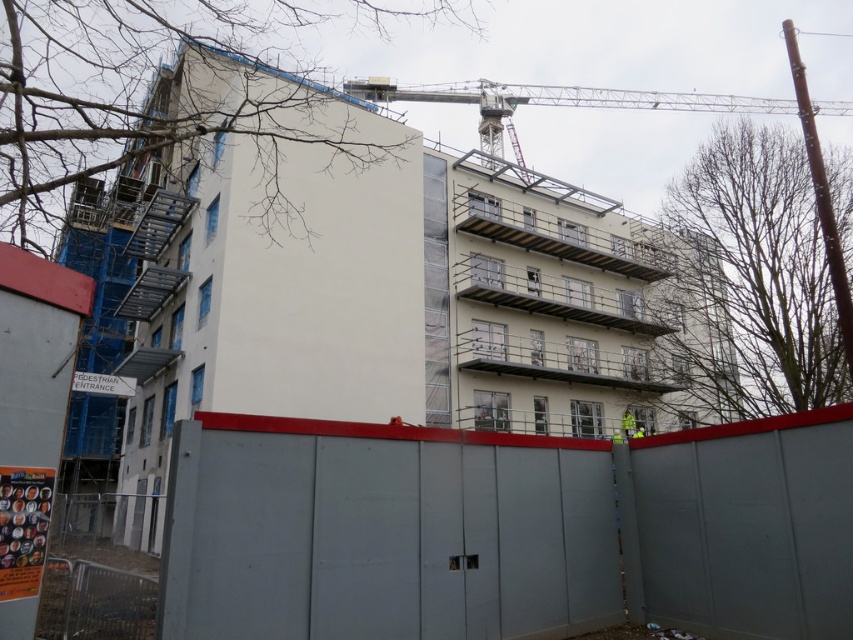
Which is in front, point (370, 579) or point (792, 106)?

Positioned in front is point (370, 579).

The image size is (853, 640). I want to click on gray metal fence at lower center, so click(x=505, y=531).

Who is more distant from viewer, (289, 449) or (811, 104)?

Positioned behind is point (811, 104).

Where is `gray metal fence at lower center`? The height and width of the screenshot is (640, 853). gray metal fence at lower center is located at coordinates (505, 531).

Consider the image. Does metallic silver crane at upper center appear on the left side of metallic silver fence at lower left?

Incorrect, metallic silver crane at upper center is not on the left side of metallic silver fence at lower left.

Measure the distance from metallic silver crane at upper center to metallic silver fence at lower left.

metallic silver crane at upper center and metallic silver fence at lower left are 75.85 feet apart.

Locate an element on the screen. The image size is (853, 640). metallic silver crane at upper center is located at coordinates (554, 100).

Where is `metallic silver crane at upper center`? This screenshot has height=640, width=853. metallic silver crane at upper center is located at coordinates (554, 100).

Measure the distance between point [604,611] and camera.

A distance of 24.05 feet exists between point [604,611] and camera.

Who is higher up, gray metal fence at lower center or reflective yellow safety vest at center?

gray metal fence at lower center

Which is in front, point (384, 440) or point (634, 422)?

Point (384, 440)

Image resolution: width=853 pixels, height=640 pixels. What are the coordinates of `gray metal fence at lower center` in the screenshot? It's located at 505,531.